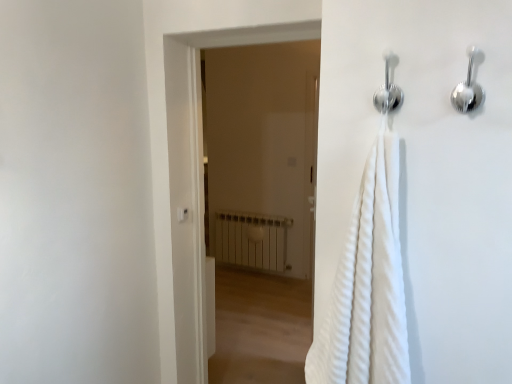
Locate an element on the screen. The height and width of the screenshot is (384, 512). free location in front of white matte radiator at center is located at coordinates (247, 294).